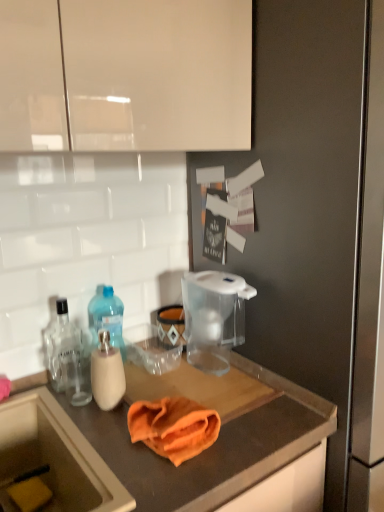
Locate an element on the screen. This screenshot has height=512, width=384. vacant area to the left of orange microfiber cloth at center is located at coordinates (94, 438).